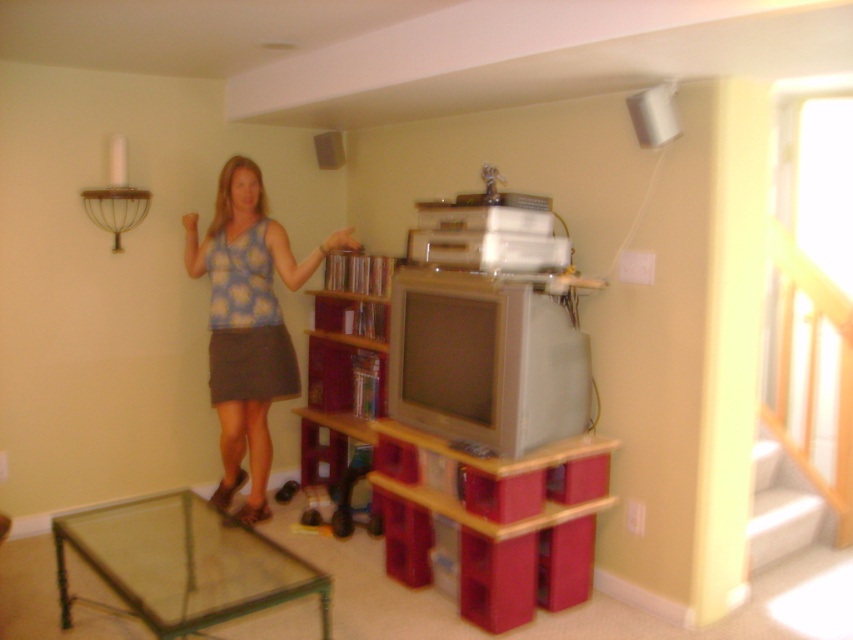
Question: Which object appears farthest from the camera in this image?

Choices:
 (A) transparent glass table at lower left
 (B) blue floral tank top at center

Answer: (B)

Question: Which object is the closest to the transparent glass table at lower left?

Choices:
 (A) blue floral tank top at center
 (B) wooden bookshelf at center

Answer: (A)

Question: Considering the relative positions of transparent glass table at lower left and wooden bookshelf at center in the image provided, where is transparent glass table at lower left located with respect to wooden bookshelf at center?

Choices:
 (A) left
 (B) right

Answer: (A)

Question: Can you confirm if transparent glass table at lower left is positioned above wooden bookshelf at center?

Choices:
 (A) yes
 (B) no

Answer: (B)

Question: Which of the following is the farthest from the observer?

Choices:
 (A) transparent glass table at lower left
 (B) blue floral tank top at center
 (C) wooden bookshelf at center

Answer: (C)

Question: Does transparent glass table at lower left come in front of wooden bookshelf at center?

Choices:
 (A) no
 (B) yes

Answer: (B)